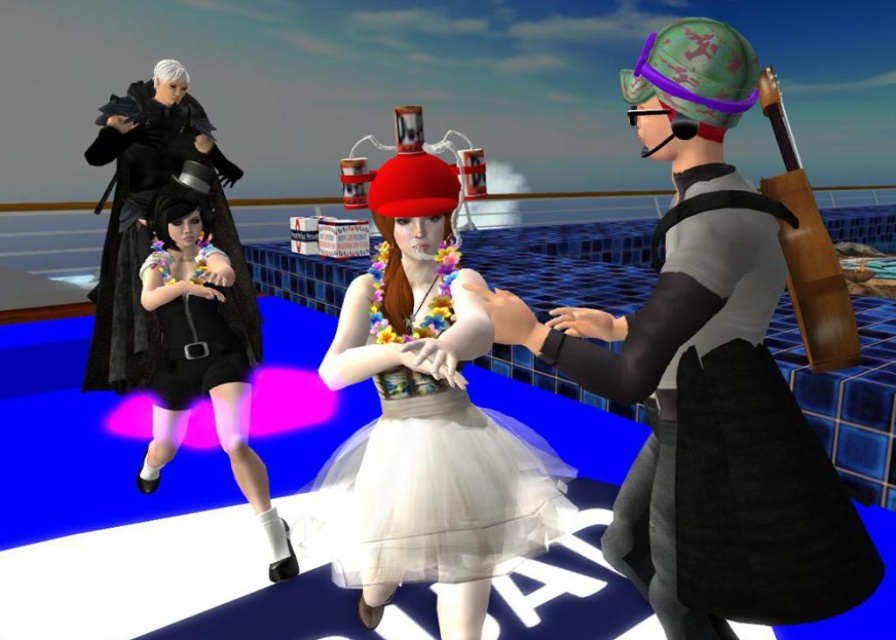
Question: Estimate the real-world distances between objects in this image. Which object is closer to the black satin dress at left?

Choices:
 (A) white tulle dress at center
 (B) black satin dress at lower left
 (C) black matte dress at left
 (D) matte black dress at right

Answer: (B)

Question: Considering the real-world distances, which object is farthest from the black satin dress at lower left?

Choices:
 (A) matte black dress at right
 (B) black matte dress at left
 (C) black satin dress at left
 (D) white tulle dress at center

Answer: (A)

Question: From the image, what is the correct spatial relationship of black satin dress at left in relation to black satin dress at lower left?

Choices:
 (A) above
 (B) below

Answer: (B)

Question: Which is farther from the matte black dress at right?

Choices:
 (A) black satin dress at lower left
 (B) black matte dress at left

Answer: (B)

Question: Does white tulle dress at center lie behind black satin dress at left?

Choices:
 (A) no
 (B) yes

Answer: (A)

Question: Is matte black dress at right thinner than black satin dress at left?

Choices:
 (A) yes
 (B) no

Answer: (A)